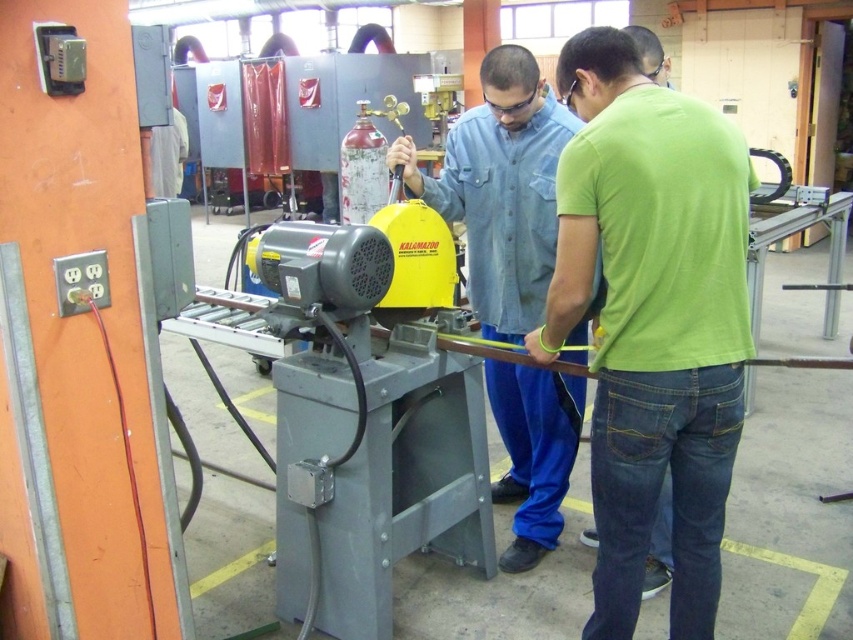
You are observing two workers in a workshop. You see a green cotton shirt at center and a denim shirt at center. Which worker is standing closer to you?

The green cotton shirt at center is closer to the viewer than the denim shirt at center, so the worker wearing the green cotton shirt at center is standing closer to you.

You are standing in the workshop and want to reach the point marked at coordinates (x=613, y=278). Considering your height is 5 feet 10 inches, can you comfortably reach that point without needing a stool?

The point at coordinates (x=613, y=278) is 5.98 feet away from the viewer. Since your height is 5 feet 10 inches, you can comfortably reach that point without needing a stool.

In the workshop scene, there are two people wearing a green cotton shirt at center and a denim shirt at center. Which one is positioned lower in the image?

The green cotton shirt at center is below the denim shirt at center, so the person wearing the green cotton shirt at center is positioned lower in the image.